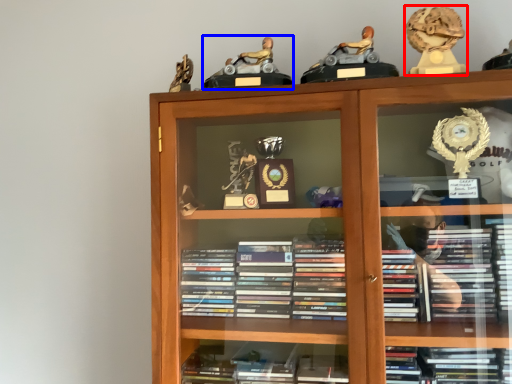
Question: Among these objects, which one is farthest to the camera, toy (highlighted by a red box) or toy (highlighted by a blue box)?

Choices:
 (A) toy
 (B) toy

Answer: (B)